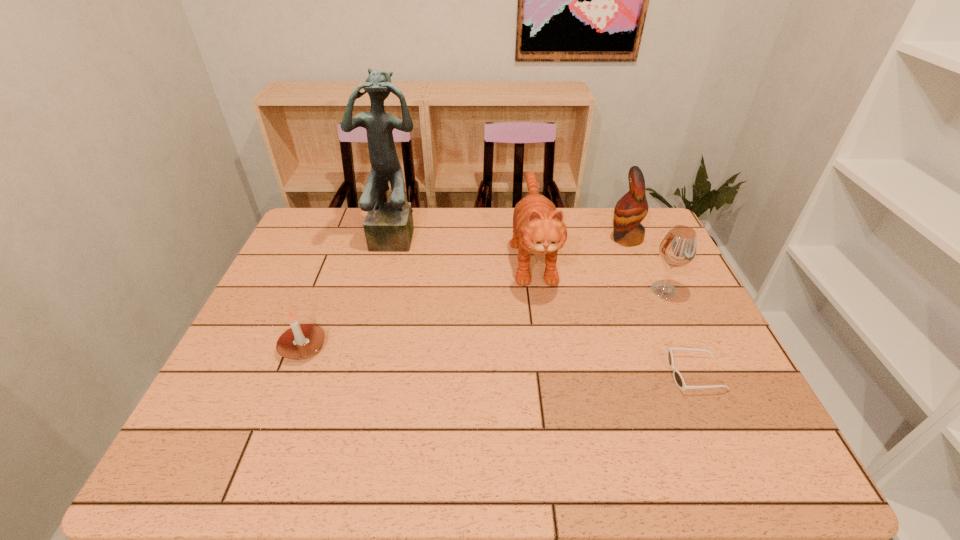
Locate an element on the screen. The width and height of the screenshot is (960, 540). free spot between the parrot and the second object from left to right is located at coordinates (512, 237).

Image resolution: width=960 pixels, height=540 pixels. Find the location of `vacant point located between the wineglass and the sunglasses`. vacant point located between the wineglass and the sunglasses is located at coordinates (680, 332).

Find the location of `object that is the closest to the fourth tallest object`. object that is the closest to the fourth tallest object is located at coordinates (632, 208).

Identify which object is the second nearest to the fourth object from right to left. Please provide its 2D coordinates. Your answer should be formatted as a tuple, i.e. [(x, y)], where the tuple contains the x and y coordinates of a point satisfying the conditions above.

[(678, 248)]

Identify the location of vacant area in the image that satisfies the following two spatial constraints: 1. on the face of the third shortest object; 2. on the right side of the tallest object. (386, 289).

Where is `vacant area that satisfies the following two spatial constraints: 1. on the face of the parrot; 2. on the back side of the fourth tallest object`? This screenshot has width=960, height=540. vacant area that satisfies the following two spatial constraints: 1. on the face of the parrot; 2. on the back side of the fourth tallest object is located at coordinates 647,289.

Identify the location of free point that satisfies the following two spatial constraints: 1. on the face of the sculpture; 2. on the left side of the fourth tallest object. The height and width of the screenshot is (540, 960). (x=386, y=289).

Identify the location of free space that satisfies the following two spatial constraints: 1. on the back side of the candle; 2. on the left side of the fourth tallest object. (325, 289).

Image resolution: width=960 pixels, height=540 pixels. Identify the location of vacant space that satisfies the following two spatial constraints: 1. on the face of the wineglass; 2. on the left side of the sculpture. (386, 289).